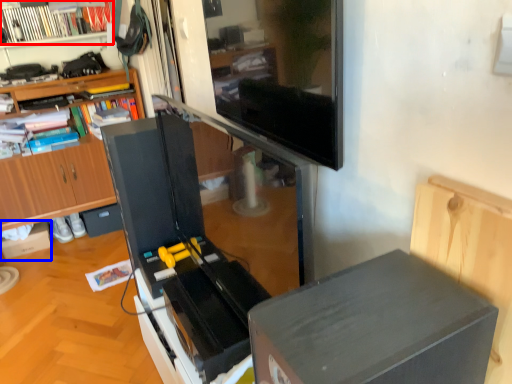
Question: Which of the following is the closest to the observer, book (highlighted by a red box) or cardboard box (highlighted by a blue box)?

Choices:
 (A) book
 (B) cardboard box

Answer: (A)